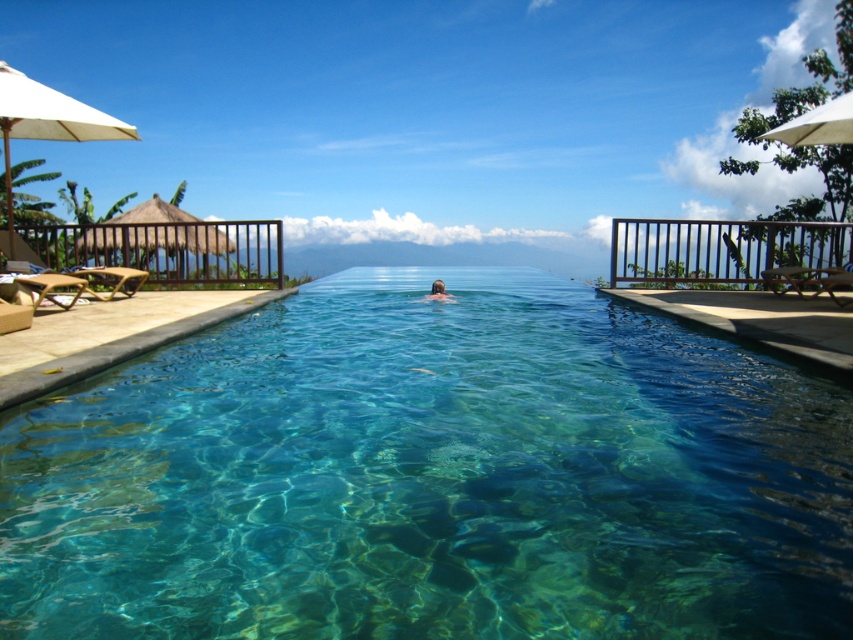
Measure the distance between point (1, 129) and camera.

A distance of 9.50 meters exists between point (1, 129) and camera.

Does white fabric umbrella at left have a larger size compared to brown hair at center?

Yes.

Identify the location of white fabric umbrella at left. (45, 122).

Is clear glass pool at center shorter than white fabric umbrella at upper right?

Incorrect, clear glass pool at center's height does not fall short of white fabric umbrella at upper right's.

Is clear glass pool at center taller than white fabric umbrella at upper right?

Yes, clear glass pool at center is taller than white fabric umbrella at upper right.

Who is more distant from viewer, (x=440, y=532) or (x=811, y=136)?

The point (x=811, y=136) is behind.

I want to click on clear glass pool at center, so click(432, 476).

Is clear glass pool at center above white fabric umbrella at left?

No, clear glass pool at center is not above white fabric umbrella at left.

Measure the distance between point (625, 365) and camera.

Point (625, 365) is 5.69 meters away from camera.

Which is behind, point (302, 630) or point (51, 104)?

The point (51, 104) is behind.

Image resolution: width=853 pixels, height=640 pixels. I want to click on clear glass pool at center, so click(x=432, y=476).